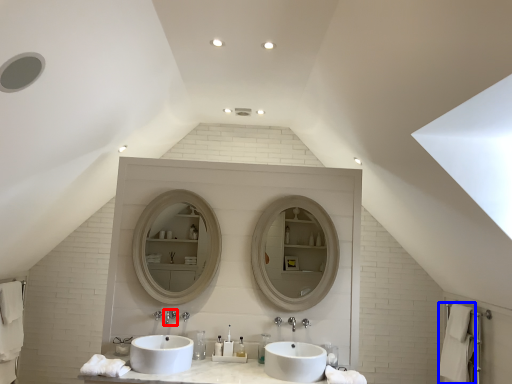
Question: Which object is closer to the camera taking this photo, tap (highlighted by a red box) or bath towel (highlighted by a blue box)?

Choices:
 (A) tap
 (B) bath towel

Answer: (A)